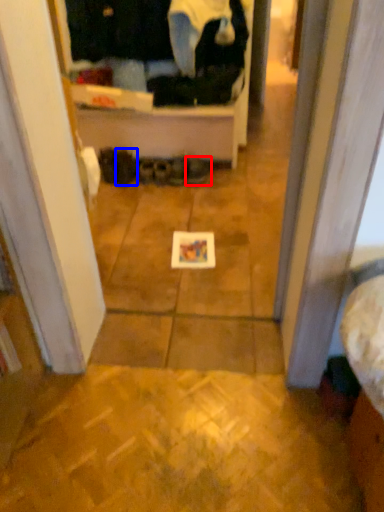
Question: Among these objects, which one is nearest to the camera, footwear (highlighted by a red box) or footwear (highlighted by a blue box)?

Choices:
 (A) footwear
 (B) footwear

Answer: (A)